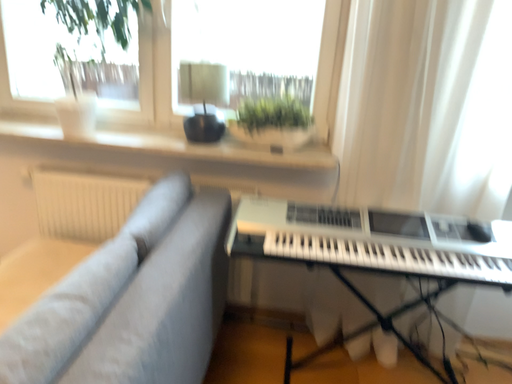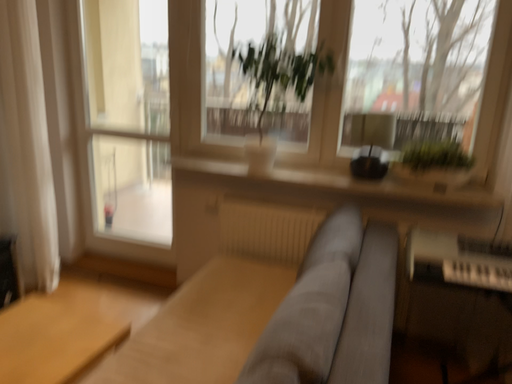
Question: Which way did the camera rotate in the video?

Choices:
 (A) rotated left
 (B) rotated right

Answer: (A)